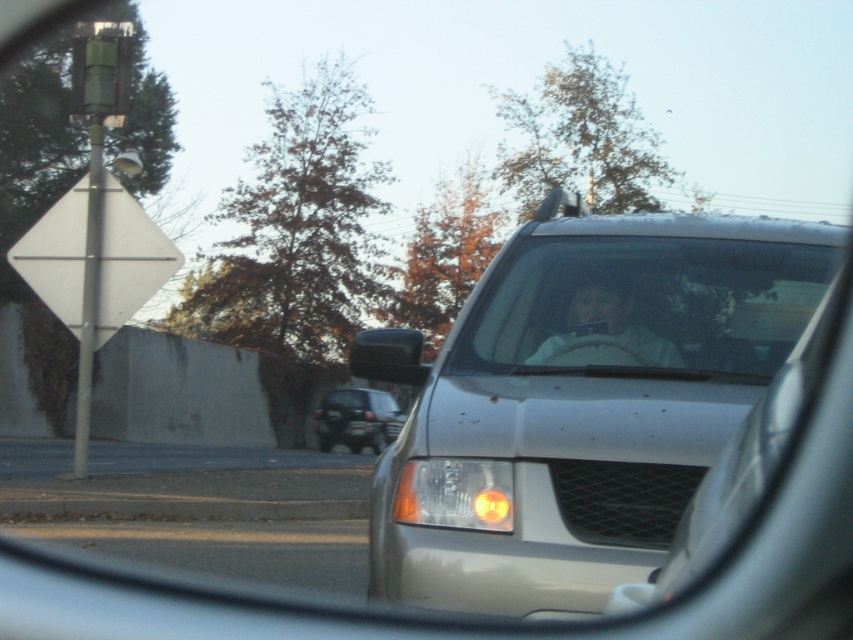
Is dark gray matte suv at center shorter than black plastic license plate at center?

In fact, dark gray matte suv at center may be taller than black plastic license plate at center.

Does dark gray matte suv at center appear over black plastic license plate at center?

Actually, dark gray matte suv at center is below black plastic license plate at center.

Which is behind, point (355, 452) or point (354, 429)?

The point (354, 429) is more distant.

Find the location of a particular element. The height and width of the screenshot is (640, 853). dark gray matte suv at center is located at coordinates [357, 419].

Is dark gray matte suv at center smaller than black rubber rearview mirror at center?

Indeed, dark gray matte suv at center has a smaller size compared to black rubber rearview mirror at center.

The width and height of the screenshot is (853, 640). What do you see at coordinates (357, 419) in the screenshot?
I see `dark gray matte suv at center` at bounding box center [357, 419].

The width and height of the screenshot is (853, 640). In order to click on dark gray matte suv at center in this screenshot , I will do `click(357, 419)`.

From the picture: Is satin silver van at center above dark gray matte suv at center?

Correct, satin silver van at center is located above dark gray matte suv at center.

Can you confirm if satin silver van at center is wider than dark gray matte suv at center?

No, satin silver van at center is not wider than dark gray matte suv at center.

What do you see at coordinates (585, 403) in the screenshot? Image resolution: width=853 pixels, height=640 pixels. I see `satin silver van at center` at bounding box center [585, 403].

Find the location of a particular element. Image resolution: width=853 pixels, height=640 pixels. satin silver van at center is located at coordinates (585, 403).